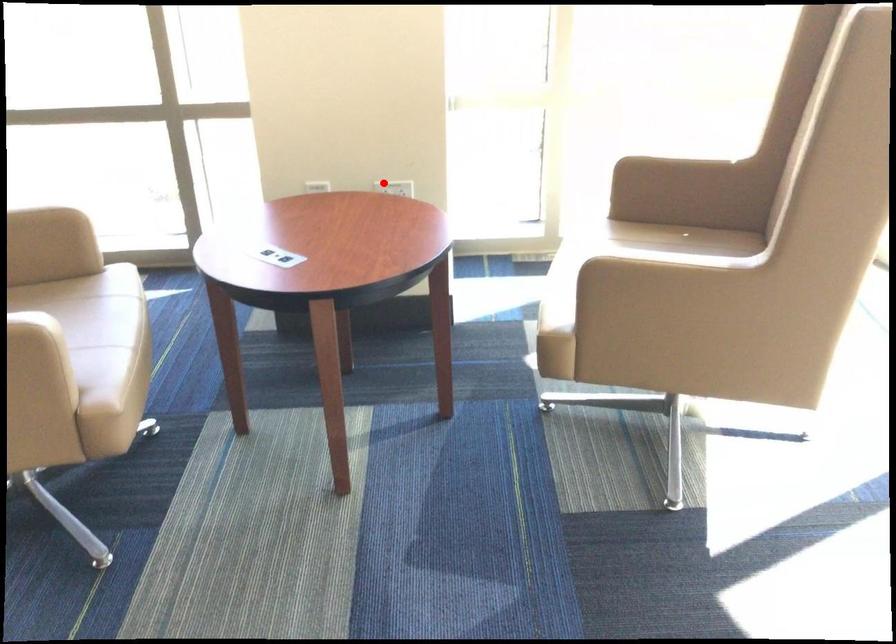
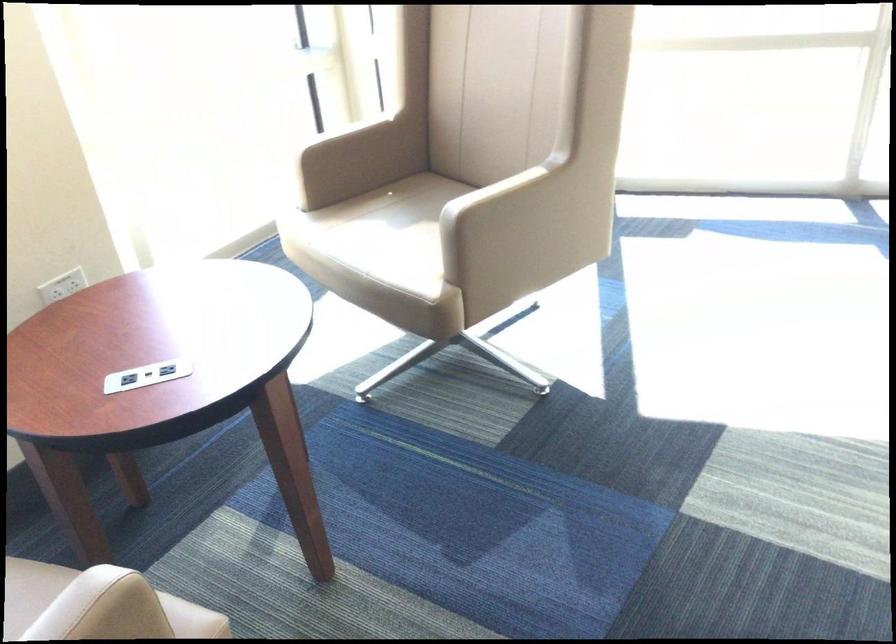
Where in the second image is the point corresponding to the highlighted location from the first image?

(62, 286)